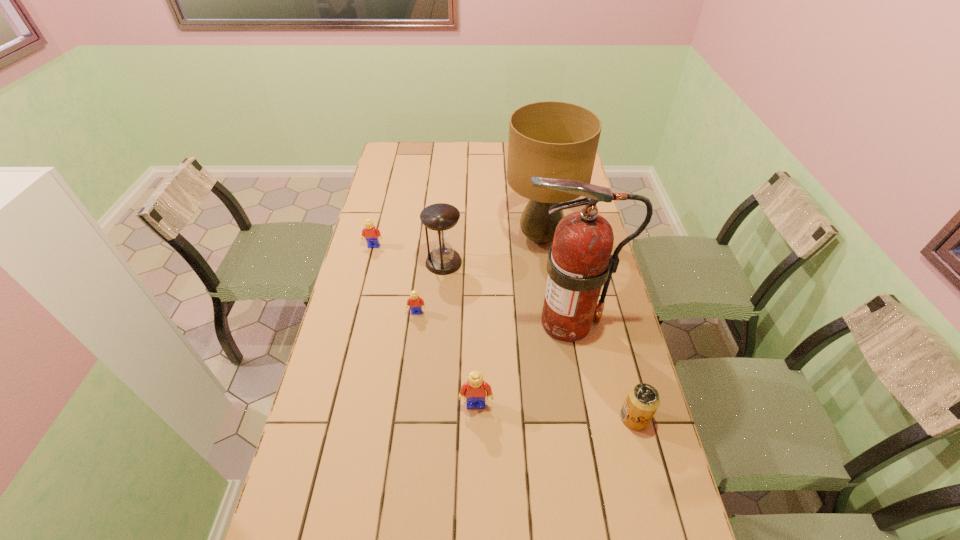
You are a GUI agent. You are given a task and a screenshot of the screen. Output one action in this format:
    pyautogui.click(x=<x>, y=<y>)
    Task: Click on the free space between the tallest Lego and the lampshade
    
    Given the screenshot: What is the action you would take?
    pyautogui.click(x=509, y=321)

Find the location of a particular element. Image resolution: width=960 pixels, height=540 pixels. empty space that is in between the fifth shortest object and the nearest Lego is located at coordinates tap(460, 333).

This screenshot has width=960, height=540. Identify the location of vacant region between the fire extinguisher and the beer can. (601, 370).

Image resolution: width=960 pixels, height=540 pixels. I want to click on free area in between the fifth shortest object and the leftmost Lego, so click(409, 254).

Find the location of a particular element. free space that is in between the lampshade and the shortest Lego is located at coordinates (479, 275).

What are the coordinates of `free spot between the leftmost Lego and the fire extinguisher` in the screenshot? It's located at (470, 284).

Identify which object is the sixth closest to the fifth shortest object. Please provide its 2D coordinates. Your answer should be formatted as a tuple, i.e. [(x, y)], where the tuple contains the x and y coordinates of a point satisfying the conditions above.

[(642, 401)]

This screenshot has width=960, height=540. What are the coordinates of `the third closest object to the third tallest object` in the screenshot? It's located at tap(370, 232).

In order to click on Lego that can be found as the second closest to the tallest Lego in this screenshot , I will do 370,232.

Choose which Lego is the nearest neighbor to the leftmost Lego. Please provide its 2D coordinates. Your answer should be formatted as a tuple, i.e. [(x, y)], where the tuple contains the x and y coordinates of a point satisfying the conditions above.

[(415, 303)]